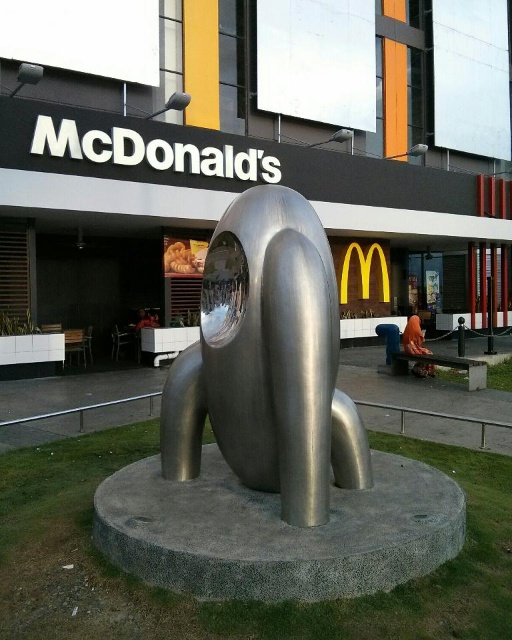
Question: Which of the following is the farthest from the observer?

Choices:
 (A) (168, 420)
 (B) (260, 45)

Answer: (B)

Question: Which point appears closest to the camera in this image?

Choices:
 (A) (227, 426)
 (B) (449, 228)

Answer: (A)

Question: In this image, where is polished stainless steel sculpture at center located relative to shiny metallic dog at center?

Choices:
 (A) above
 (B) below

Answer: (A)

Question: Observing the image, what is the correct spatial positioning of polished stainless steel sculpture at center in reference to shiny metallic dog at center?

Choices:
 (A) below
 (B) above

Answer: (B)

Question: Can you confirm if polished stainless steel sculpture at center is bigger than shiny metallic dog at center?

Choices:
 (A) no
 (B) yes

Answer: (B)

Question: Which point is closer to the camera taking this photo?

Choices:
 (A) (261, 214)
 (B) (201, 154)

Answer: (A)